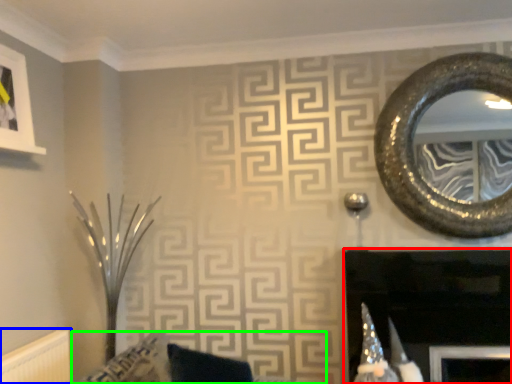
Question: Based on their relative distances, which object is farther from fireplace (highlighted by a red box)? Choose from radiator (highlighted by a blue box) and furniture (highlighted by a green box).

Choices:
 (A) radiator
 (B) furniture

Answer: (A)